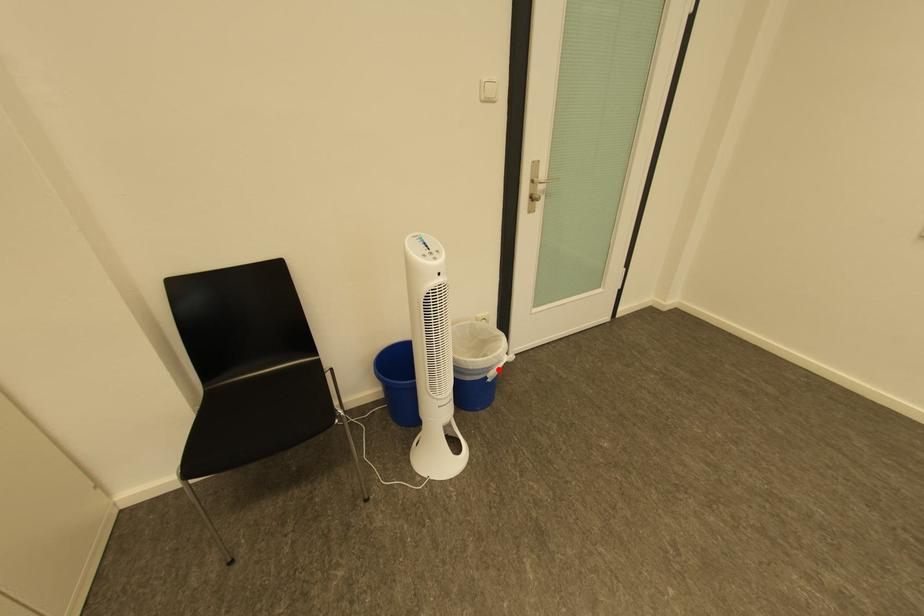
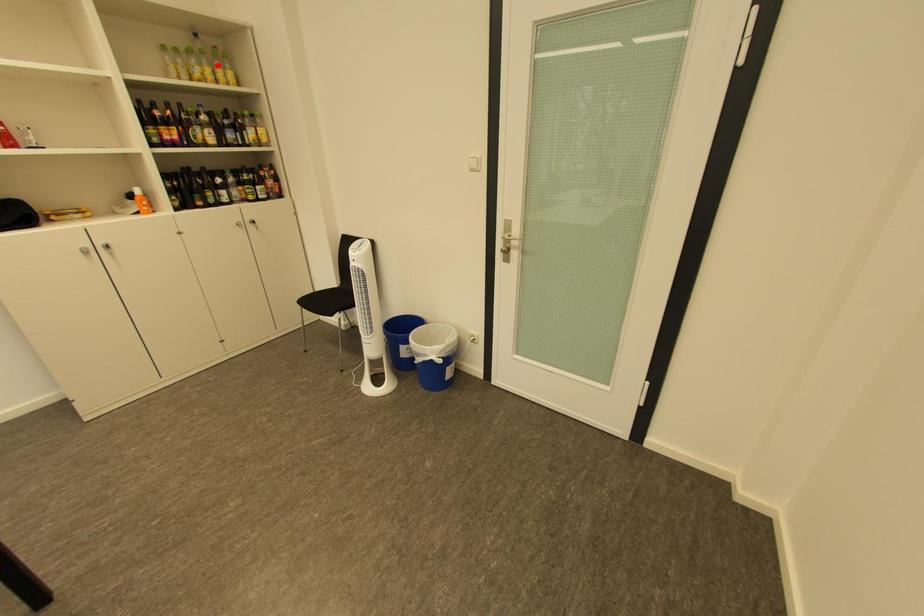
I am providing you with two images of the same scene from different viewpoints. A red point is marked on the first image and another point is marked on the second image. Does the point marked in image1 correspond to the same location as the one in image2?

No